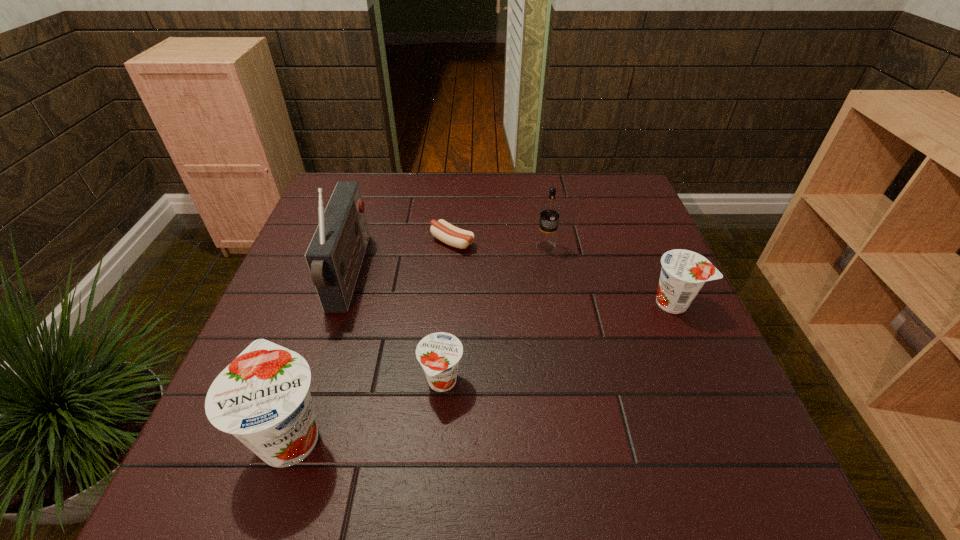
I want to click on free area in between the vodka and the fifth tallest object, so click(493, 315).

Where is `vacant area between the shortest object and the tallest yogurt`? The width and height of the screenshot is (960, 540). vacant area between the shortest object and the tallest yogurt is located at coordinates (372, 338).

Locate an element on the screen. This screenshot has width=960, height=540. vacant area between the shortest object and the second shortest object is located at coordinates (447, 312).

Identify the location of free space between the rightmost object and the second object from right to left. (610, 275).

Where is `object that can be found as the second closest to the radio receiver`? The width and height of the screenshot is (960, 540). object that can be found as the second closest to the radio receiver is located at coordinates (262, 397).

Find the location of a particular element. Image resolution: width=960 pixels, height=540 pixels. object that is the second closest to the fourth tallest object is located at coordinates (453, 236).

The width and height of the screenshot is (960, 540). I want to click on yogurt that can be found as the second closest to the tallest yogurt, so click(684, 272).

Image resolution: width=960 pixels, height=540 pixels. Identify the location of yogurt object that ranks as the closest to the shortest yogurt. (262, 397).

Find the location of a particular element. The image size is (960, 540). free spot that satisfies the following two spatial constraints: 1. on the front panel of the tallest object; 2. on the left side of the second yogurt from right to left is located at coordinates (316, 382).

At what (x,y) coordinates should I click in order to perform the action: click on free region that satisfies the following two spatial constraints: 1. on the front panel of the radio receiver; 2. on the right side of the shortest yogurt. Please return your answer as a coordinate pair (x, y). This screenshot has height=540, width=960. Looking at the image, I should click on (316, 382).